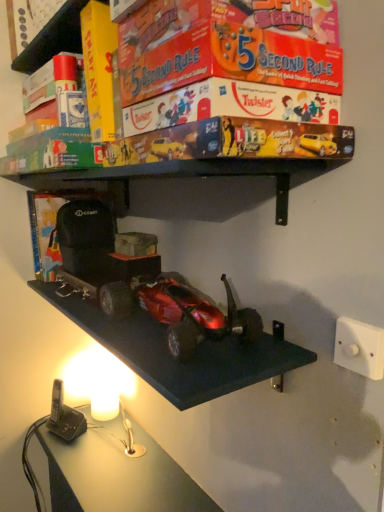
What do you see at coordinates (359, 347) in the screenshot? Image resolution: width=384 pixels, height=512 pixels. I see `white plastic/light switch at lower right` at bounding box center [359, 347].

Find the location of a particular element. matt board game at upper center is located at coordinates pos(231,106).

Which is farther from the camera, (366, 330) or (338, 142)?

The point (366, 330) is behind.

In the scene shown: Considering the positions of objects white plastic/light switch at lower right and matt board game at upper center in the image provided, who is more to the right, white plastic/light switch at lower right or matt board game at upper center?

Positioned to the right is white plastic/light switch at lower right.

Is white plastic/light switch at lower right further to camera compared to matt board game at upper center?

Yes, the depth of white plastic/light switch at lower right is greater than that of matt board game at upper center.

Could you tell me if matt board game at upper center is facing white plastic/light switch at lower right?

No, matt board game at upper center is not oriented towards white plastic/light switch at lower right.

Are matt board game at upper center and white plastic/light switch at lower right far apart?

Actually, matt board game at upper center and white plastic/light switch at lower right are a little close together.

Is matt board game at upper center smaller than white plastic/light switch at lower right?

No, matt board game at upper center is not smaller than white plastic/light switch at lower right.

From their relative heights in the image, would you say matt board game at upper center is taller or shorter than white plastic/light switch at lower right?

Considering their sizes, matt board game at upper center has more height than white plastic/light switch at lower right.

Between shiny metallic car at center and matt board game at upper center, which one has larger width?

matt board game at upper center.

Considering the relative sizes of shiny metallic car at center and matt board game at upper center in the image provided, is shiny metallic car at center taller than matt board game at upper center?

No, shiny metallic car at center is not taller than matt board game at upper center.

Where is `model car below the matt board game at upper center (from a real-world perspective)`? This screenshot has height=512, width=384. model car below the matt board game at upper center (from a real-world perspective) is located at coordinates (194, 314).

Does matt board game at upper center have a larger size compared to shiny metallic car at center?

Yes.

Which is more to the right, matt board game at upper center or shiny metallic car at center?

matt board game at upper center is more to the right.

From the image's perspective, which one is positioned higher, matt board game at upper center or shiny metallic car at center?

matt board game at upper center is shown above in the image.

Is matt board game at upper center surrounding shiny metallic car at center?

No, shiny metallic car at center is not surrounded by matt board game at upper center.

Which point is more forward, (203, 300) or (374, 370)?

The point (374, 370) is in front.

Is white plastic/light switch at lower right at the back of shiny metallic car at center?

That's not correct — shiny metallic car at center is not looking away from white plastic/light switch at lower right.

Identify the location of light switch below the shiny metallic car at center (from a real-world perspective). The width and height of the screenshot is (384, 512). (359, 347).

Who is bigger, shiny metallic car at center or white plastic/light switch at lower right?

With larger size is shiny metallic car at center.

From the picture: Considering the relative positions of white plastic/light switch at lower right and shiny metallic car at center in the image provided, is white plastic/light switch at lower right in front of shiny metallic car at center?

Yes, white plastic/light switch at lower right is in front of shiny metallic car at center.

This screenshot has height=512, width=384. In order to click on light switch directly beneath the shiny metallic car at center (from a real-world perspective) in this screenshot , I will do `click(359, 347)`.

Looking at this image, from the image's perspective, which is above, white plastic/light switch at lower right or shiny metallic car at center?

shiny metallic car at center appears higher in the image.

Which is correct: white plastic/light switch at lower right is inside shiny metallic car at center, or outside of it?

white plastic/light switch at lower right lies outside shiny metallic car at center.

Find the location of a particular element. light switch beneath the matt board game at upper center (from a real-world perspective) is located at coordinates (x=359, y=347).

The image size is (384, 512). I want to click on light switch on the right side of matt board game at upper center, so click(359, 347).

Which object lies further to the anchor point matt board game at upper center, white plastic/light switch at lower right or shiny metallic car at center?

Based on the image, white plastic/light switch at lower right appears to be further to matt board game at upper center.

From the image, which object appears to be nearer to white plastic/light switch at lower right, matt board game at upper center or shiny metallic car at center?

Based on the image, shiny metallic car at center appears to be nearer to white plastic/light switch at lower right.

Considering their positions, is matt board game at upper center positioned closer to shiny metallic car at center than white plastic/light switch at lower right?

white plastic/light switch at lower right is closer to shiny metallic car at center.

Based on their spatial positions, is white plastic/light switch at lower right or matt board game at upper center further from shiny metallic car at center?

matt board game at upper center is further to shiny metallic car at center.

Estimate the real-world distances between objects in this image. Which object is closer to white plastic/light switch at lower right, shiny metallic car at center or matt board game at upper center?

Based on the image, shiny metallic car at center appears to be nearer to white plastic/light switch at lower right.

Looking at the image, which one is located closer to matt board game at upper center, shiny metallic car at center or white plastic/light switch at lower right?

Among the two, shiny metallic car at center is located nearer to matt board game at upper center.

Where is `model car between matt board game at upper center and white plastic/light switch at lower right vertically`? model car between matt board game at upper center and white plastic/light switch at lower right vertically is located at coordinates (194, 314).